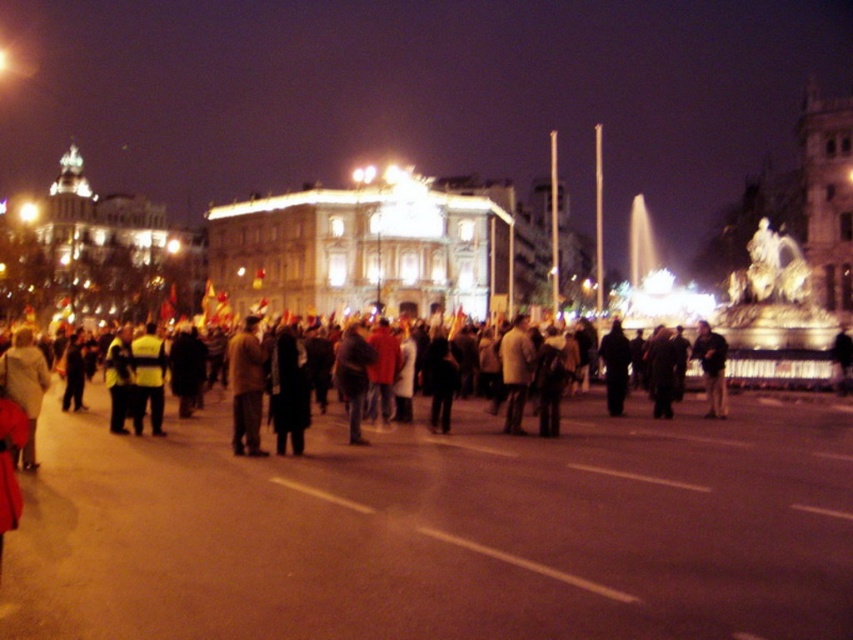
Is point (408, 451) farther from viewer compared to point (712, 369)?

No, it is not.

Does dark gray clothing at center have a greater height compared to dark gray jacket at center?

Correct, dark gray clothing at center is much taller as dark gray jacket at center.

Which is in front, point (573, 522) or point (699, 321)?

Positioned in front is point (573, 522).

The image size is (853, 640). Find the location of `dark gray clothing at center`. dark gray clothing at center is located at coordinates (416, 465).

Which is in front, point (252, 371) or point (706, 324)?

Point (252, 371)

Which is more to the right, dark brown coat at center or dark gray jacket at center?

Positioned to the right is dark gray jacket at center.

Does point (231, 349) come behind point (709, 387)?

No, it is not.

This screenshot has width=853, height=640. What are the coordinates of `dark brown coat at center` in the screenshot? It's located at (247, 387).

Measure the distance between point (218, 428) and camera.

Point (218, 428) is 94.53 meters away from camera.

Does dark gray clothing at center appear on the left side of dark brown leather jacket at center?

Yes, dark gray clothing at center is to the left of dark brown leather jacket at center.

Is point (97, 476) farther from viewer compared to point (527, 371)?

That is False.

The width and height of the screenshot is (853, 640). What are the coordinates of `dark gray clothing at center` in the screenshot? It's located at (416, 465).